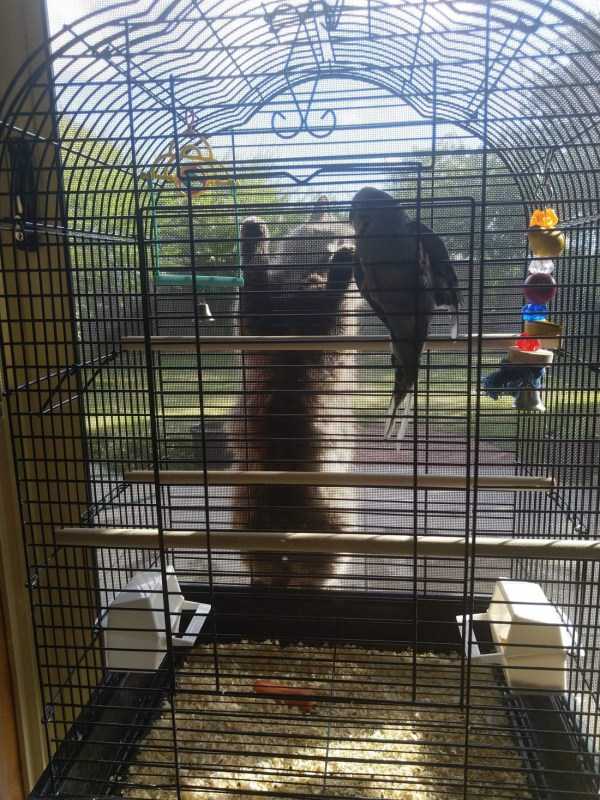
The height and width of the screenshot is (800, 600). What are the coordinates of `birdcage ornament with yellow, clear, white and red stones` in the screenshot? It's located at (552, 220), (545, 268), (537, 312), (528, 344).